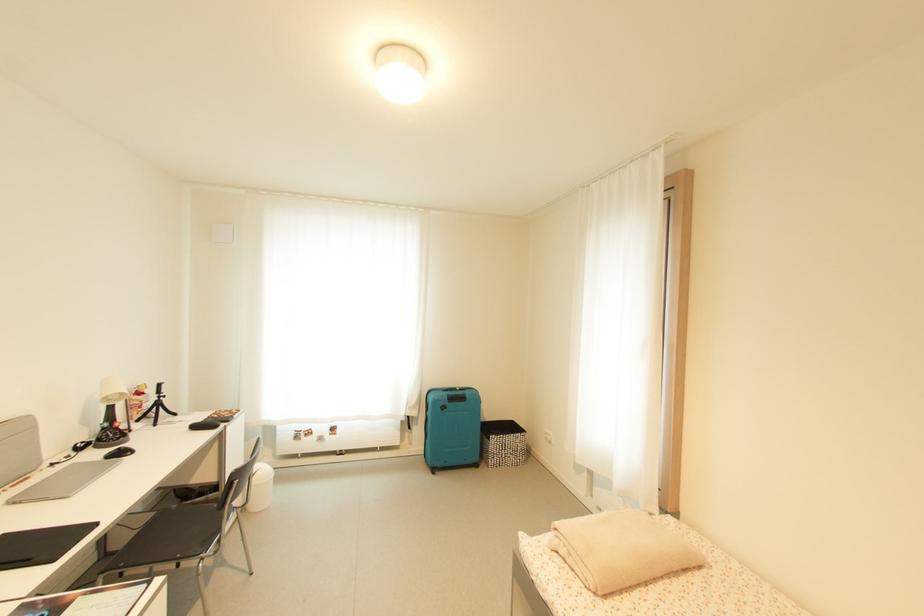
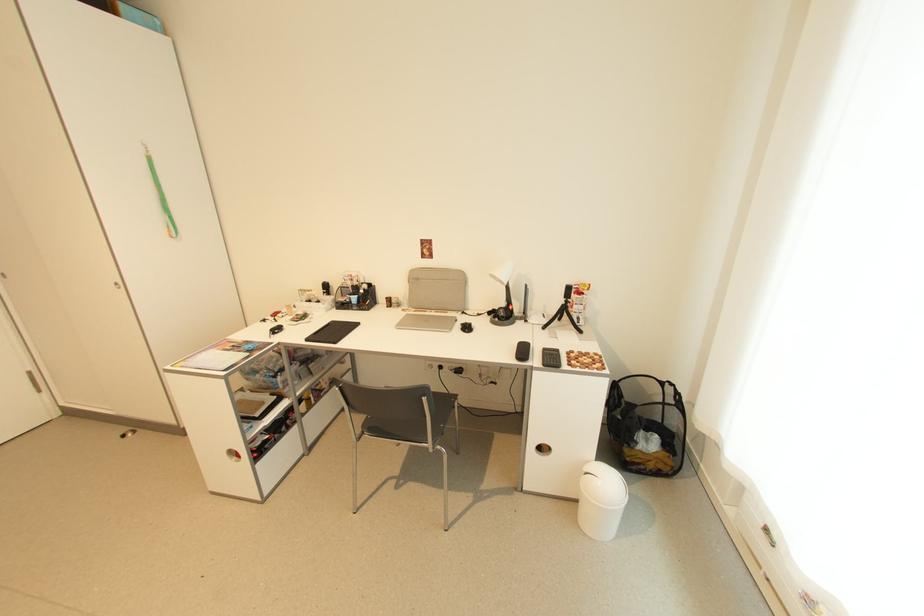
In the second image, find the point that corresponds to (164,399) in the first image.

(572, 302)